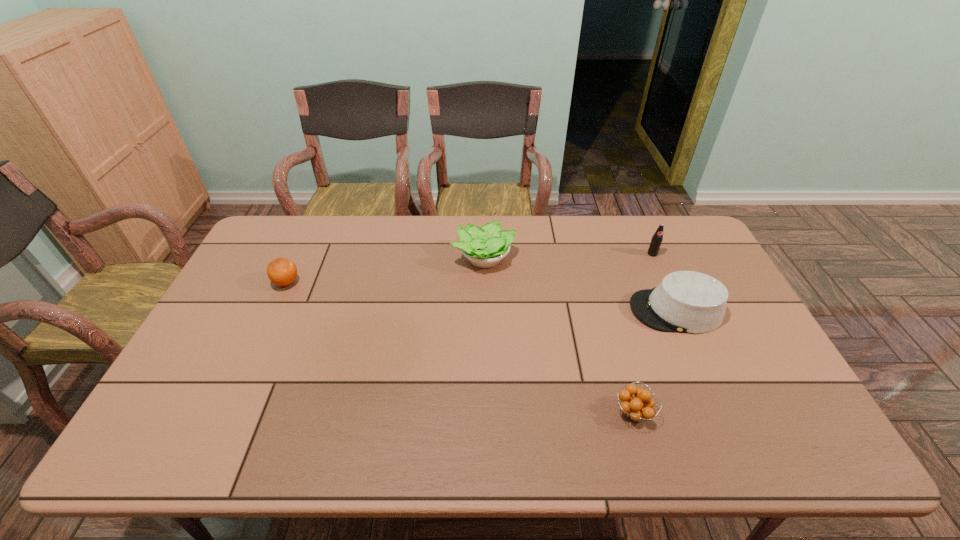
At what (x,y) coordinates should I click in order to perform the action: click on pop. Please return your answer as a coordinate pair (x, y). The image size is (960, 540). Looking at the image, I should click on coord(656,240).

Where is `the second object from left to right`? the second object from left to right is located at coordinates (484, 247).

The height and width of the screenshot is (540, 960). I want to click on hat, so click(685, 301).

The height and width of the screenshot is (540, 960). Find the location of `the taller orange fruit`. the taller orange fruit is located at coordinates (281, 271).

The height and width of the screenshot is (540, 960). Identify the location of the leftmost object. (281, 271).

Identify the location of the shortest object. This screenshot has height=540, width=960. (638, 408).

Image resolution: width=960 pixels, height=540 pixels. Identify the location of the right orange fruit. (638, 408).

The height and width of the screenshot is (540, 960). Find the location of `free space located 0.230m on the front label of the tallest object`. free space located 0.230m on the front label of the tallest object is located at coordinates (676, 306).

Find the location of `vacant space located 0.400m on the left of the lettuce`. vacant space located 0.400m on the left of the lettuce is located at coordinates [335, 258].

You are a GUI agent. You are given a task and a screenshot of the screen. Output one action in this format:
    pyautogui.click(x=<x>, y=<y>)
    Task: Click on the vacant region located on the front-facing side of the hat
    Image resolution: width=960 pixels, height=540 pixels.
    Given the screenshot: What is the action you would take?
    point(542,310)